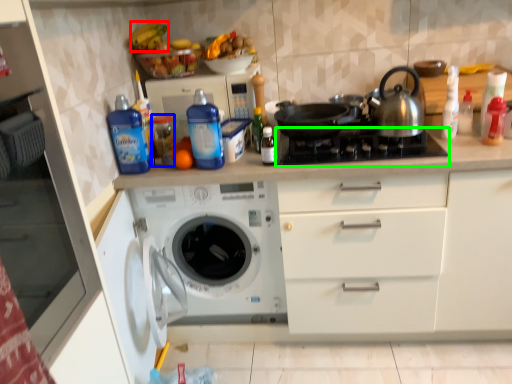
Question: Which object is the closest to the banana (highlighted by a red box)? Choose among these: bottle (highlighted by a blue box) or gas stove (highlighted by a green box).

Choices:
 (A) bottle
 (B) gas stove

Answer: (A)